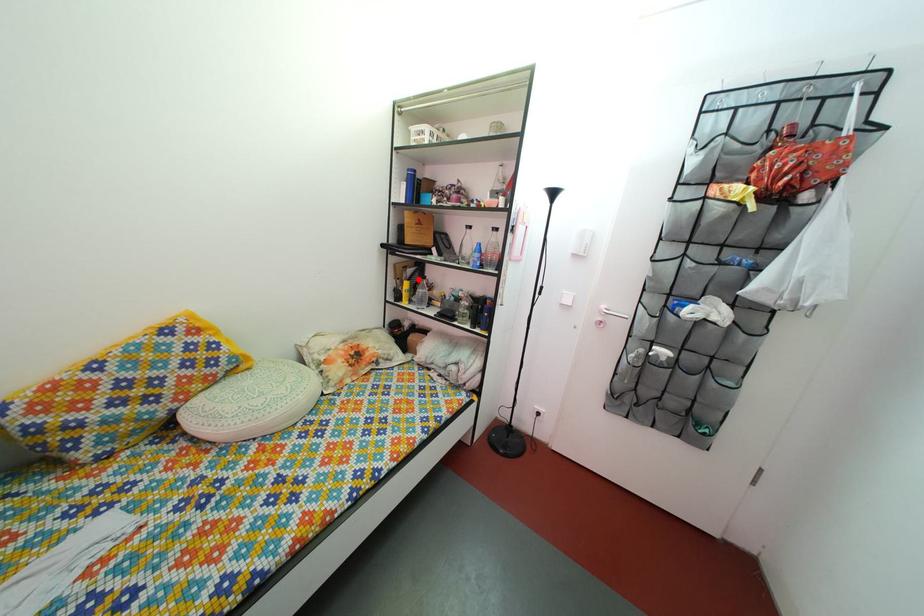
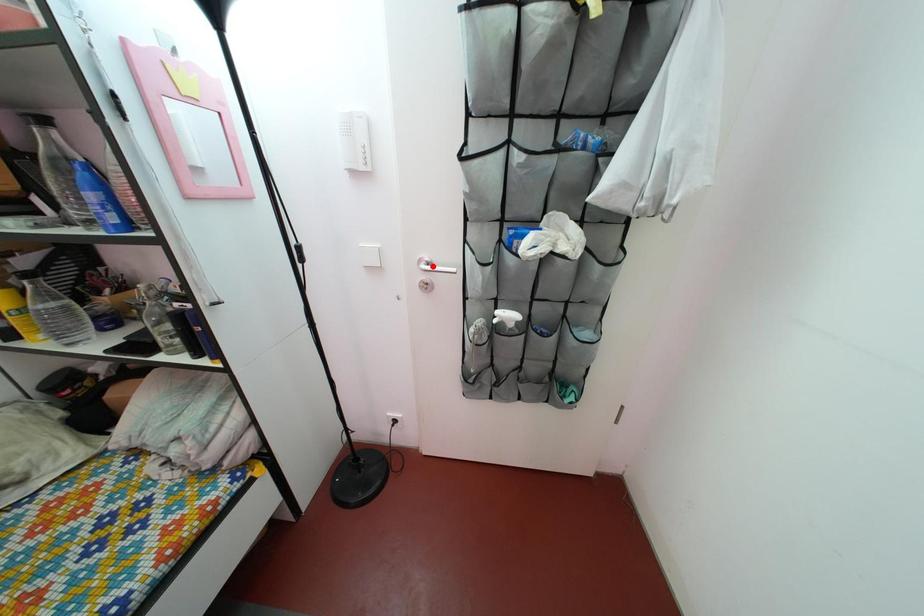
I am providing you with two images of the same scene from different viewpoints. A red point is marked on the first image and another point is marked on the second image. Is the red point in image1 aligned with the point shown in image2?

No